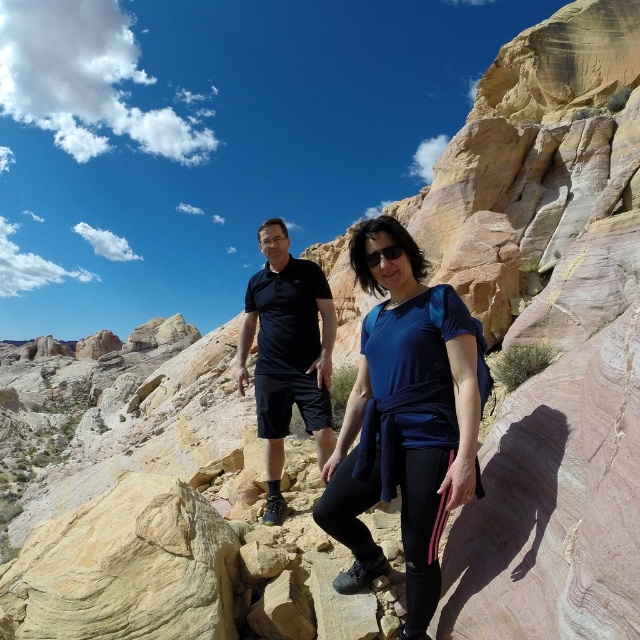
Where is `blue fabric shirt at center`? This screenshot has height=640, width=640. blue fabric shirt at center is located at coordinates 404,419.

Consider the image. Which is more to the left, blue fabric shirt at center or matte black polo shirt at center?

matte black polo shirt at center is more to the left.

The width and height of the screenshot is (640, 640). I want to click on blue fabric shirt at center, so click(404, 419).